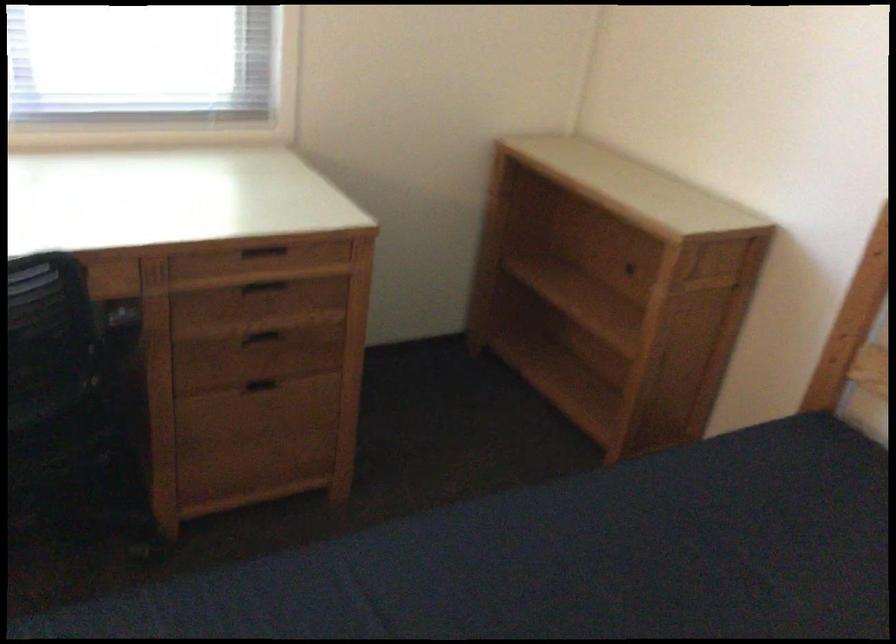
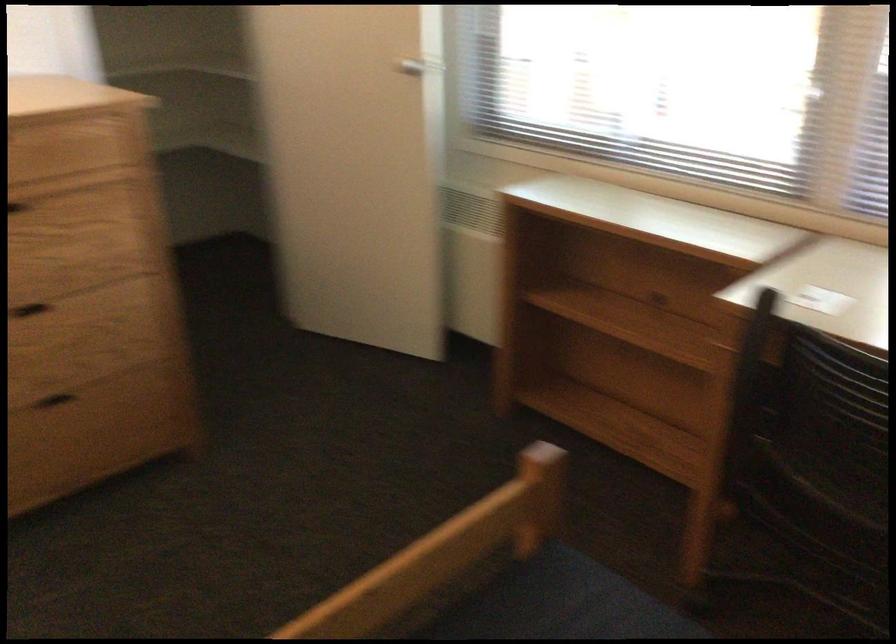
Question: The first image is from the beginning of the video and the second image is from the end. How did the camera likely rotate when shooting the video?

Choices:
 (A) Left
 (B) Right
 (C) Up
 (D) Down

Answer: (A)